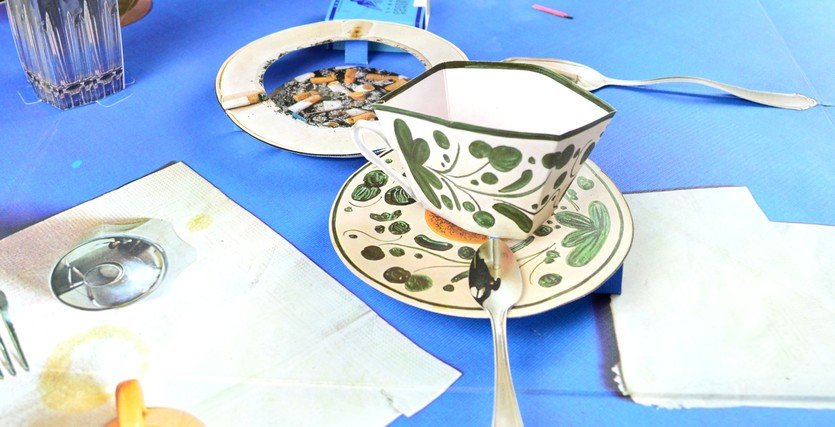
Find the location of a particular element. delicate cup and saucer is located at coordinates (479, 176), (380, 270).